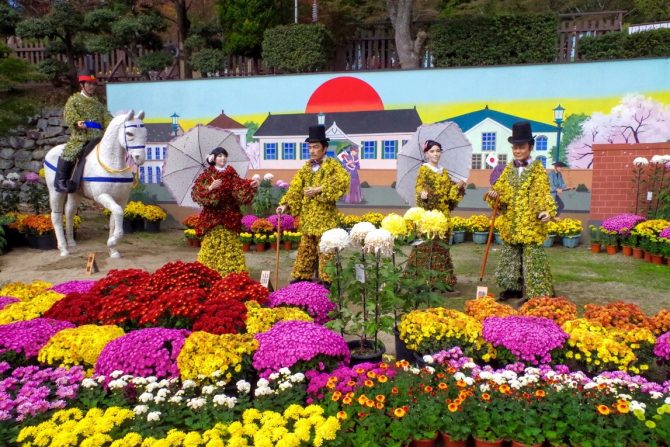
Locate an element on the screen. The image size is (670, 447). red bunch of flowers is located at coordinates pos(84,304), pos(124,303), pos(218,310), pos(182,290), pos(182,275), pos(224,283), pos(135,274).